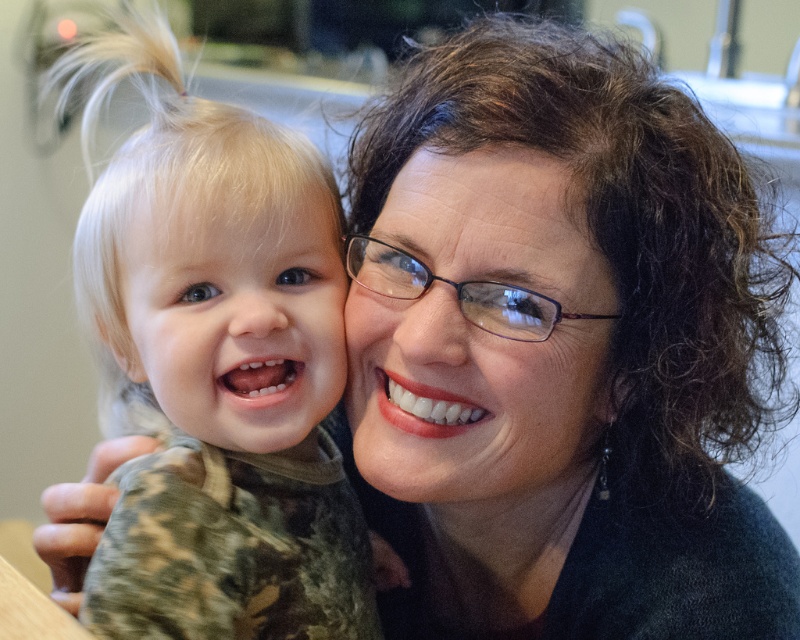
You are a photographer standing in front of the scene. You want to take a photo of the camouflage fabric toddler at left. Where should you position yourself to capture the toddler in the frame?

The camouflage fabric toddler at left is located at point 0.584 on the x axis and 0.279 on the y axis, so you should position yourself to the left side of the scene and slightly above to capture the toddler in the frame.

You are a photographer setting up for a family portrait. You need to position the camouflage fabric toddler at left and the smooth skin face at center so that both fit within the camera frame. Based on their sizes, which object should be placed closer to the camera to ensure they both fit?

The camouflage fabric toddler at left is wider than the smooth skin face at center. To ensure both fit within the camera frame, the camouflage fabric toddler at left should be placed closer to the camera since wider objects need to be nearer to maintain proper framing.